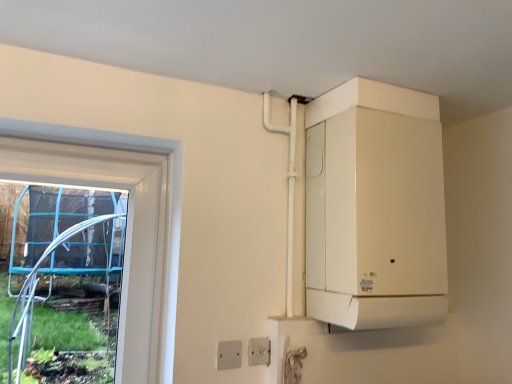
The height and width of the screenshot is (384, 512). What do you see at coordinates (229, 354) in the screenshot?
I see `white plastic electric outlet at lower center, the 2th electric outlet positioned from the back` at bounding box center [229, 354].

This screenshot has width=512, height=384. Identify the location of white plastic electric outlet at lower center, marked as the 1th electric outlet in a back-to-front arrangement. (259, 351).

Describe the element at coordinates (376, 208) in the screenshot. I see `white matte boiler at upper right` at that location.

You are a GUI agent. You are given a task and a screenshot of the screen. Output one action in this format:
    pyautogui.click(x=<x>, y=<y>)
    Task: Click on the white plastic electric outlet at lower center, the 2th electric outlet positioned from the back
    
    Given the screenshot: What is the action you would take?
    tap(229, 354)

From a real-world perspective, which is physically above, white plastic electric outlet at lower center, the 1th electric outlet from the right, or white matte boiler at upper right?

From a 3D spatial view, white matte boiler at upper right is above.

From the image's perspective, which one is positioned higher, white plastic electric outlet at lower center, the 1th electric outlet from the right, or white matte boiler at upper right?

white matte boiler at upper right, from the image's perspective.

Is white plastic electric outlet at lower center, the 1th electric outlet from the right, taller than white matte boiler at upper right?

Incorrect, the height of white plastic electric outlet at lower center, the 1th electric outlet from the right, is not larger of that of white matte boiler at upper right.

Visually, is white plastic electric outlet at lower center, placed as the 2th electric outlet when sorted from front to back, positioned to the left or to the right of white matte boiler at upper right?

white plastic electric outlet at lower center, placed as the 2th electric outlet when sorted from front to back, is positioned on white matte boiler at upper right's left side.

Where is `electric outlet that is under the white plastic electric outlet at lower center, which ranks as the second electric outlet in left-to-right order (from a real-world perspective)`? electric outlet that is under the white plastic electric outlet at lower center, which ranks as the second electric outlet in left-to-right order (from a real-world perspective) is located at coordinates (229, 354).

Is white plastic electric outlet at lower center, which ranks as the second electric outlet in left-to-right order, positioned beyond the bounds of white plastic electric outlet at lower center, the first electric outlet when ordered from front to back?

white plastic electric outlet at lower center, which ranks as the second electric outlet in left-to-right order, lies outside white plastic electric outlet at lower center, the first electric outlet when ordered from front to back,'s area.

Does white plastic electric outlet at lower center, marked as the 1th electric outlet in a back-to-front arrangement, have a larger size compared to white plastic electric outlet at lower center, the 2th electric outlet positioned from the back?

Yes.

How distant is white plastic electric outlet at lower center, marked as the 1th electric outlet in a back-to-front arrangement, from white plastic electric outlet at lower center, which is counted as the second electric outlet, starting from the right?

white plastic electric outlet at lower center, marked as the 1th electric outlet in a back-to-front arrangement, is 3.01 inches from white plastic electric outlet at lower center, which is counted as the second electric outlet, starting from the right.

Does white plastic electric outlet at lower center, the 2th electric outlet positioned from the back, have a greater height compared to white matte boiler at upper right?

No, white plastic electric outlet at lower center, the 2th electric outlet positioned from the back, is not taller than white matte boiler at upper right.

Is point (234, 364) closer or farther from the camera than point (337, 190)?

Point (234, 364) is closer to the camera than point (337, 190).

How much distance is there between white plastic electric outlet at lower center, which is the first electric outlet in left-to-right order, and white matte boiler at upper right?

26.11 inches.

From a real-world perspective, does white plastic electric outlet at lower center, which is counted as the second electric outlet, starting from the right, stand above white matte boiler at upper right?

No, from a real-world perspective, white plastic electric outlet at lower center, which is counted as the second electric outlet, starting from the right, is not over white matte boiler at upper right

From the image's perspective, would you say white plastic electric outlet at lower center, the 2th electric outlet positioned from the back, is positioned over white plastic electric outlet at lower center, marked as the 1th electric outlet in a back-to-front arrangement?

Correct, white plastic electric outlet at lower center, the 2th electric outlet positioned from the back, appears higher than white plastic electric outlet at lower center, marked as the 1th electric outlet in a back-to-front arrangement, in the image.

From a real-world perspective, who is located higher, white plastic electric outlet at lower center, the first electric outlet when ordered from front to back, or white plastic electric outlet at lower center, which ranks as the second electric outlet in left-to-right order?

white plastic electric outlet at lower center, which ranks as the second electric outlet in left-to-right order, is physically above.

Is white plastic electric outlet at lower center, the first electric outlet when ordered from front to back, directly adjacent to white plastic electric outlet at lower center, which ranks as the second electric outlet in left-to-right order?

Absolutely, white plastic electric outlet at lower center, the first electric outlet when ordered from front to back, is next to and touching white plastic electric outlet at lower center, which ranks as the second electric outlet in left-to-right order.

Which point is more forward, [237,353] or [269,350]?

Point [237,353]

What are the coordinates of `appliance to the right of white plastic electric outlet at lower center, which ranks as the second electric outlet in left-to-right order` in the screenshot? It's located at (376, 208).

Is point (366, 314) in front of point (257, 358)?

Yes, point (366, 314) is in front of point (257, 358).

From the image's perspective, is white matte boiler at upper right above white plastic electric outlet at lower center, marked as the 1th electric outlet in a back-to-front arrangement?

Indeed, from the image's perspective, white matte boiler at upper right is shown above white plastic electric outlet at lower center, marked as the 1th electric outlet in a back-to-front arrangement.

Does white matte boiler at upper right have a greater height compared to white plastic electric outlet at lower center, the 1th electric outlet from the right?

Correct, white matte boiler at upper right is much taller as white plastic electric outlet at lower center, the 1th electric outlet from the right.

Which is in front, white matte boiler at upper right or white plastic electric outlet at lower center, which is the first electric outlet in left-to-right order?

white matte boiler at upper right is closer to the camera.

How different are the orientations of white matte boiler at upper right and white plastic electric outlet at lower center, which is the first electric outlet in left-to-right order, in degrees?

The angle between the facing direction of white matte boiler at upper right and the facing direction of white plastic electric outlet at lower center, which is the first electric outlet in left-to-right order, is 0.0215 degrees.

Is white matte boiler at upper right aimed at white plastic electric outlet at lower center, which is the first electric outlet in left-to-right order?

No, white matte boiler at upper right is not oriented towards white plastic electric outlet at lower center, which is the first electric outlet in left-to-right order.

Considering the positions of objects white matte boiler at upper right and white plastic electric outlet at lower center, which is counted as the second electric outlet, starting from the right, in the image provided, who is more to the left, white matte boiler at upper right or white plastic electric outlet at lower center, which is counted as the second electric outlet, starting from the right,?

white plastic electric outlet at lower center, which is counted as the second electric outlet, starting from the right, is more to the left.

Identify the location of appliance that appears above the white plastic electric outlet at lower center, the 1th electric outlet from the right (from a real-world perspective). (376, 208).

The width and height of the screenshot is (512, 384). I want to click on electric outlet located above the white plastic electric outlet at lower center, placed as the 2th electric outlet when sorted from front to back (from the image's perspective), so click(229, 354).

From the image, which object appears to be farther from white plastic electric outlet at lower center, the 1th electric outlet from the right, white matte boiler at upper right or white plastic electric outlet at lower center, the first electric outlet when ordered from front to back?

white matte boiler at upper right.

Based on their spatial positions, is white plastic electric outlet at lower center, marked as the 1th electric outlet in a back-to-front arrangement, or white plastic electric outlet at lower center, which is the first electric outlet in left-to-right order, further from white matte boiler at upper right?

Based on the image, white plastic electric outlet at lower center, which is the first electric outlet in left-to-right order, appears to be further to white matte boiler at upper right.

When comparing their distances from white plastic electric outlet at lower center, which ranks as the second electric outlet in left-to-right order, does white plastic electric outlet at lower center, which is counted as the second electric outlet, starting from the right, or white matte boiler at upper right seem closer?

white plastic electric outlet at lower center, which is counted as the second electric outlet, starting from the right, lies closer to white plastic electric outlet at lower center, which ranks as the second electric outlet in left-to-right order, than the other object.

When comparing their distances from white plastic electric outlet at lower center, the 2th electric outlet positioned from the back, does white plastic electric outlet at lower center, marked as the 1th electric outlet in a back-to-front arrangement, or white matte boiler at upper right seem closer?

white plastic electric outlet at lower center, marked as the 1th electric outlet in a back-to-front arrangement, lies closer to white plastic electric outlet at lower center, the 2th electric outlet positioned from the back, than the other object.

From the image, which object appears to be farther from white matte boiler at upper right, white plastic electric outlet at lower center, the 2th electric outlet positioned from the back, or white plastic electric outlet at lower center, which ranks as the second electric outlet in left-to-right order?

white plastic electric outlet at lower center, the 2th electric outlet positioned from the back.

Based on the photo, estimate the real-world distances between objects in this image. Which object is closer to white plastic electric outlet at lower center, which is counted as the second electric outlet, starting from the right, white matte boiler at upper right or white plastic electric outlet at lower center, which ranks as the second electric outlet in left-to-right order?

white plastic electric outlet at lower center, which ranks as the second electric outlet in left-to-right order, is closer to white plastic electric outlet at lower center, which is counted as the second electric outlet, starting from the right.

The width and height of the screenshot is (512, 384). I want to click on electric outlet between white matte boiler at upper right and white plastic electric outlet at lower center, the 1th electric outlet from the right, from top to bottom, so click(229, 354).